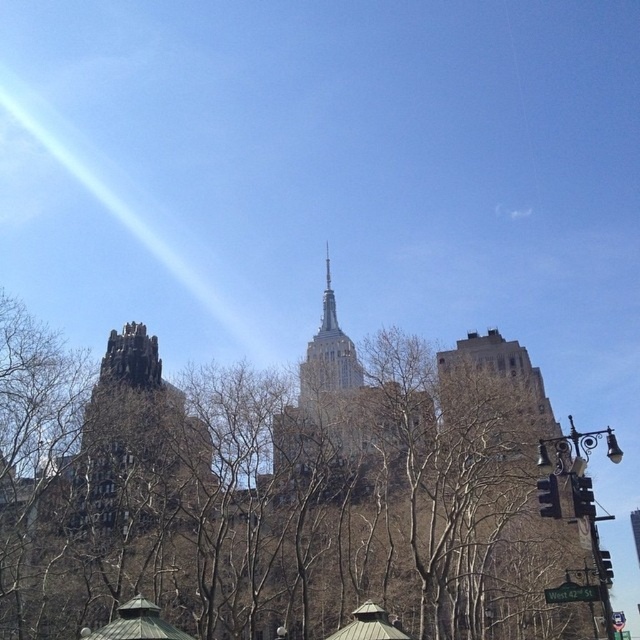
You are an architect analyzing the skyline of this city. Based on the image, which of the two structures, the brown stone building at right or the dark gray stone tower at left, has a greater height?

The brown stone building at right is taller than the dark gray stone tower at left.

You are an architect analyzing the urban layout of this scene. Considering the brown stone building at right and the dark gray stone tower at left, which structure occupies a wider horizontal space in the image?

The dark gray stone tower at left occupies a wider horizontal space because it has a greater width than the brown stone building at right.

You are standing in the park looking at the Empire State Building. You notice a brown stone building at right and a dark gray stone tower at left. Which one is positioned to the right of the other?

The brown stone building at right is positioned to the right of the dark gray stone tower at left.